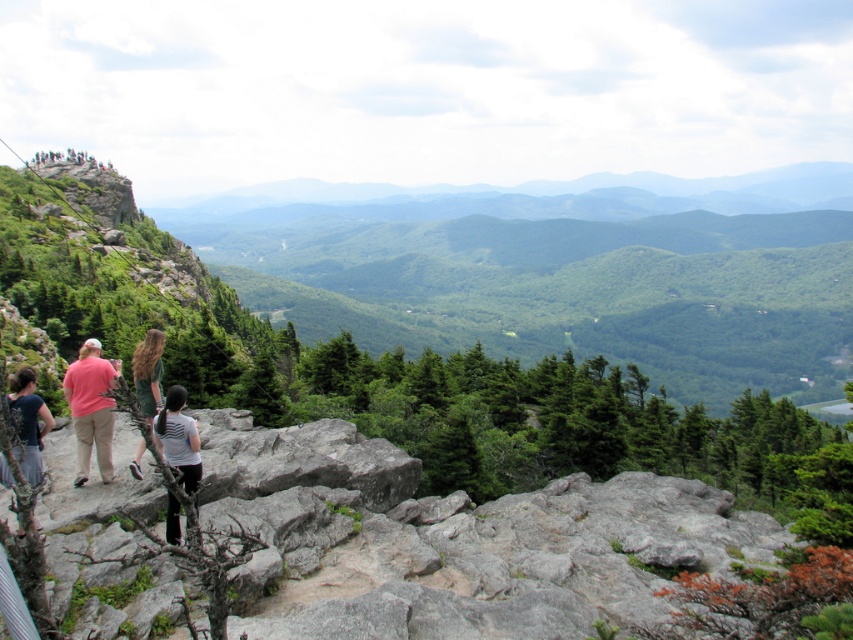
Is matte pink shirt at left to the right of green fabric dress at center from the viewer's perspective?

In fact, matte pink shirt at left is to the left of green fabric dress at center.

Is point (93, 424) more distant than point (155, 356)?

No, (93, 424) is in front of (155, 356).

Where is `matte pink shirt at left`? matte pink shirt at left is located at coordinates (91, 408).

Is white matte shirt at center to the left of matte gray shirt at lower left from the viewer's perspective?

No, white matte shirt at center is not to the left of matte gray shirt at lower left.

Which is behind, point (167, 387) or point (26, 436)?

The point (167, 387) is more distant.

Locate an element on the screen. Image resolution: width=853 pixels, height=640 pixels. white matte shirt at center is located at coordinates (178, 438).

Looking at this image, can you confirm if matte pink shirt at left is positioned to the right of white matte shirt at center?

Incorrect, matte pink shirt at left is not on the right side of white matte shirt at center.

Is point (100, 472) closer to camera compared to point (189, 480)?

No, (100, 472) is behind (189, 480).

Where is `matte pink shirt at left`? The image size is (853, 640). matte pink shirt at left is located at coordinates (91, 408).

You are a GUI agent. You are given a task and a screenshot of the screen. Output one action in this format:
    pyautogui.click(x=<x>, y=<y>)
    Task: Click on the matte pink shirt at left
    This screenshot has width=853, height=640.
    Given the screenshot: What is the action you would take?
    pyautogui.click(x=91, y=408)